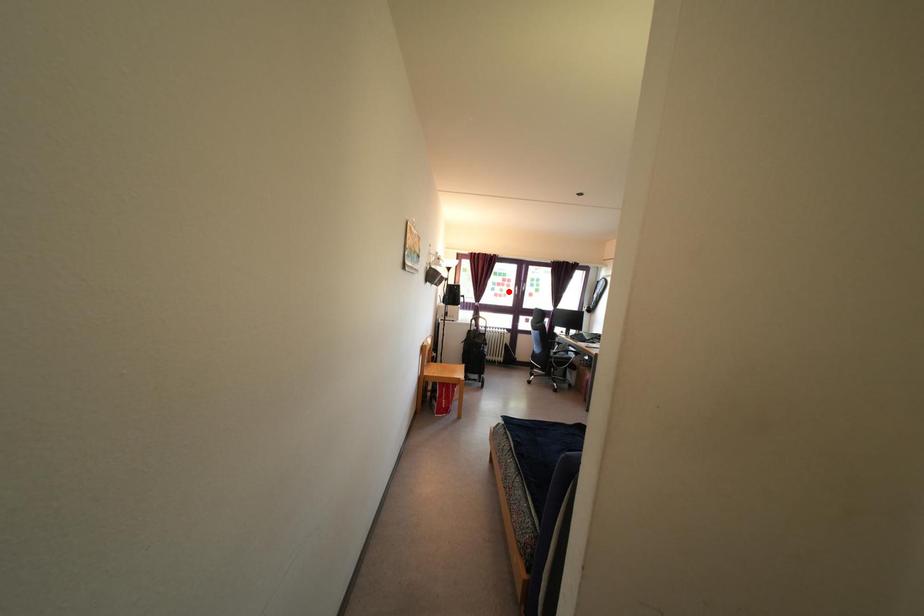
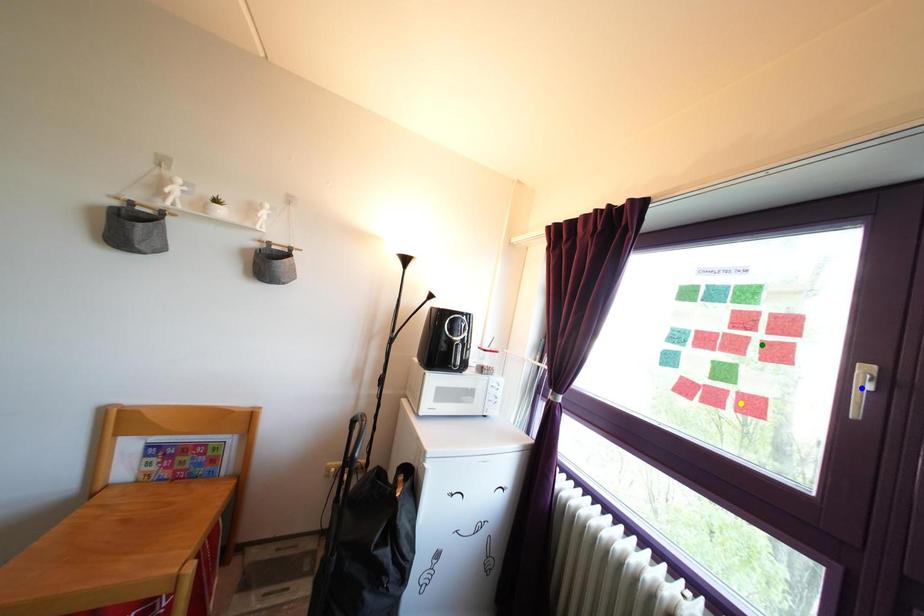
Question: I am providing you with two images of the same scene from different viewpoints. A red point is marked on the first image. You are given multiple points on the second image. Which point in image 2 is actually the same real-world point as the red point in image 1?

Choices:
 (A) green point
 (B) yellow point
 (C) blue point

Answer: (A)